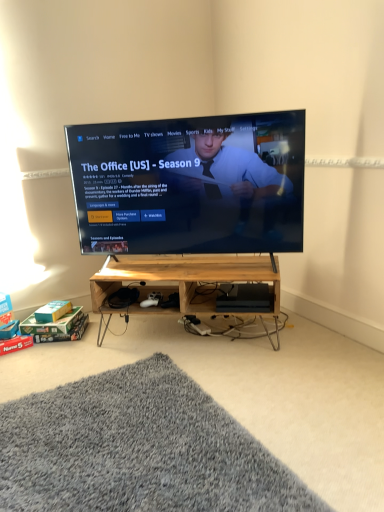
Question: Is wooden at center, placed as the second shelf when sorted from top to bottom, at the right side of gray shaggy rug at lower left?

Choices:
 (A) yes
 (B) no

Answer: (A)

Question: From a real-world perspective, is wooden at center, placed as the second shelf when sorted from top to bottom, under gray shaggy rug at lower left?

Choices:
 (A) no
 (B) yes

Answer: (A)

Question: Is wooden at center, placed as the second shelf when sorted from top to bottom, positioned with its back to gray shaggy rug at lower left?

Choices:
 (A) yes
 (B) no

Answer: (B)

Question: Considering the relative sizes of wooden at center, placed as the second shelf when sorted from top to bottom, and gray shaggy rug at lower left in the image provided, is wooden at center, placed as the second shelf when sorted from top to bottom, bigger than gray shaggy rug at lower left?

Choices:
 (A) yes
 (B) no

Answer: (A)

Question: Considering the relative sizes of wooden at center, the 1th shelf when ordered from bottom to top, and gray shaggy rug at lower left in the image provided, is wooden at center, the 1th shelf when ordered from bottom to top, shorter than gray shaggy rug at lower left?

Choices:
 (A) yes
 (B) no

Answer: (B)

Question: Relative to gray shaggy rug at lower left, is wooden at center, positioned as the 2th shelf in bottom-to-top order, in front or behind?

Choices:
 (A) behind
 (B) front

Answer: (A)

Question: Is wooden at center, positioned as the 2th shelf in bottom-to-top order, situated inside gray shaggy rug at lower left or outside?

Choices:
 (A) inside
 (B) outside

Answer: (B)

Question: From their relative heights in the image, would you say wooden at center, the 1th shelf from the top, is taller or shorter than gray shaggy rug at lower left?

Choices:
 (A) tall
 (B) short

Answer: (A)

Question: Is wooden at center, the 1th shelf from the top, bigger or smaller than gray shaggy rug at lower left?

Choices:
 (A) big
 (B) small

Answer: (B)

Question: Relative to gray shaggy rug at lower left, is wooden at center, the 1th shelf when ordered from bottom to top, in front or behind?

Choices:
 (A) front
 (B) behind

Answer: (B)

Question: Would you say wooden at center, the 1th shelf when ordered from bottom to top, is to the left or to the right of gray shaggy rug at lower left in the picture?

Choices:
 (A) right
 (B) left

Answer: (A)

Question: Considering the positions of wooden at center, the 1th shelf when ordered from bottom to top, and gray shaggy rug at lower left in the image, is wooden at center, the 1th shelf when ordered from bottom to top, wider or thinner than gray shaggy rug at lower left?

Choices:
 (A) thin
 (B) wide

Answer: (A)

Question: Considering the positions of point pos(271,287) and point pos(153,454), is point pos(271,287) closer or farther from the camera than point pos(153,454)?

Choices:
 (A) farther
 (B) closer

Answer: (A)

Question: Is point (185, 250) positioned closer to the camera than point (273, 292)?

Choices:
 (A) farther
 (B) closer

Answer: (A)

Question: Looking at their shapes, would you say matte black tv at center is wider or thinner than wooden at center, positioned as the 2th shelf in bottom-to-top order?

Choices:
 (A) thin
 (B) wide

Answer: (A)